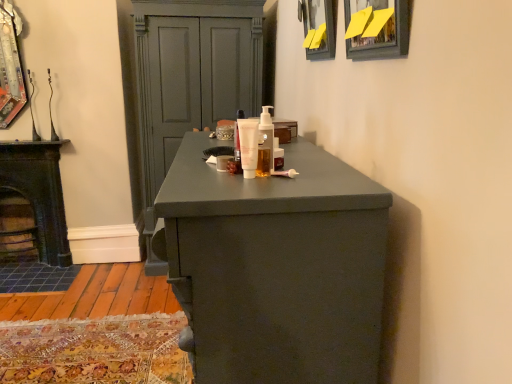
Measure the distance between point (247, 174) and camera.

They are 3.65 feet apart.

The image size is (512, 384). Describe the element at coordinates (237, 143) in the screenshot. I see `white matte tube at center` at that location.

Describe the element at coordinates (190, 80) in the screenshot. I see `matte gray cupboard at center` at that location.

What do you see at coordinates (319, 28) in the screenshot? The width and height of the screenshot is (512, 384). I see `matte black picture frame at upper center, which is the first picture frame from back to front` at bounding box center [319, 28].

Locate an element on the screen. The image size is (512, 384). white matte tube at center, marked as the 2th mouthwash in a back-to-front arrangement is located at coordinates (248, 146).

Does point (264, 175) appear closer or farther from the camera than point (183, 275)?

Point (264, 175) is positioned farther from the camera compared to point (183, 275).

From the image's perspective, which one is positioned lower, translucent plastic mouthwash at center, which ranks as the 1th mouthwash in back-to-front order, or matte gray chest of drawers at center?

matte gray chest of drawers at center.

Is translucent plastic mouthwash at center, which ranks as the 1th mouthwash in back-to-front order, next to matte gray chest of drawers at center?

No, translucent plastic mouthwash at center, which ranks as the 1th mouthwash in back-to-front order, is not touching matte gray chest of drawers at center.

In terms of size, does translucent plastic mouthwash at center, which ranks as the 1th mouthwash in back-to-front order, appear bigger or smaller than matte gray chest of drawers at center?

Considering their sizes, translucent plastic mouthwash at center, which ranks as the 1th mouthwash in back-to-front order, takes up less space than matte gray chest of drawers at center.

Could you tell me if matte black picture frame at upper center, which is the first picture frame from back to front, is turned towards white matte tube at center, marked as the 2th mouthwash in a back-to-front arrangement?

No, matte black picture frame at upper center, which is the first picture frame from back to front, is not facing towards white matte tube at center, marked as the 2th mouthwash in a back-to-front arrangement.

Can you confirm if matte black picture frame at upper center, arranged as the 2th picture frame when viewed from the front, is shorter than white matte tube at center, marked as the 2th mouthwash in a back-to-front arrangement?

Incorrect, the height of matte black picture frame at upper center, arranged as the 2th picture frame when viewed from the front, does not fall short of that of white matte tube at center, marked as the 2th mouthwash in a back-to-front arrangement.

From the image's perspective, which object appears higher, matte black picture frame at upper center, which is the first picture frame from back to front, or white matte tube at center, the first mouthwash in the front-to-back sequence?

matte black picture frame at upper center, which is the first picture frame from back to front, from the image's perspective.

Is matte black picture frame at upper center, which is the first picture frame from back to front, next to white matte tube at center, the first mouthwash in the front-to-back sequence, and touching it?

No, matte black picture frame at upper center, which is the first picture frame from back to front, is not touching white matte tube at center, the first mouthwash in the front-to-back sequence.

Where is `chest of drawers below the yellow paper at upper center, which appears as the 1th picture frame when viewed from the front (from a real-world perspective)`? This screenshot has width=512, height=384. chest of drawers below the yellow paper at upper center, which appears as the 1th picture frame when viewed from the front (from a real-world perspective) is located at coordinates (276, 268).

Who is taller, matte gray chest of drawers at center or yellow paper at upper center, the second picture frame when ordered from back to front?

Standing taller between the two is matte gray chest of drawers at center.

Can you tell me how much matte gray chest of drawers at center and yellow paper at upper center, which appears as the 1th picture frame when viewed from the front, differ in facing direction?

There is a 0.599-degree angle between the facing directions of matte gray chest of drawers at center and yellow paper at upper center, which appears as the 1th picture frame when viewed from the front.

Considering the sizes of objects matte gray chest of drawers at center and yellow paper at upper center, which appears as the 1th picture frame when viewed from the front, in the image provided, who is wider, matte gray chest of drawers at center or yellow paper at upper center, which appears as the 1th picture frame when viewed from the front,?

With larger width is matte gray chest of drawers at center.

Between matte gray cupboard at center and matte black picture frame at upper center, arranged as the 2th picture frame when viewed from the front, which one has smaller width?

With smaller width is matte black picture frame at upper center, arranged as the 2th picture frame when viewed from the front.

Is point (249, 92) positioned before point (308, 25)?

No, (249, 92) is behind (308, 25).

The image size is (512, 384). Find the location of `cupboard below the matte black picture frame at upper center, which is the first picture frame from back to front (from a real-world perspective)`. cupboard below the matte black picture frame at upper center, which is the first picture frame from back to front (from a real-world perspective) is located at coordinates (190, 80).

Which object is more forward, matte gray cupboard at center or matte black picture frame at upper center, arranged as the 2th picture frame when viewed from the front?

matte black picture frame at upper center, arranged as the 2th picture frame when viewed from the front, is closer to the camera.

Looking at this image, considering the sizes of white matte tube at center, the first mouthwash in the front-to-back sequence, and white matte tube at center in the image, is white matte tube at center, the first mouthwash in the front-to-back sequence, taller or shorter than white matte tube at center?

In the image, white matte tube at center, the first mouthwash in the front-to-back sequence, appears to be shorter than white matte tube at center.

From the image's perspective, between white matte tube at center, the first mouthwash in the front-to-back sequence, and white matte tube at center, who is located below?

white matte tube at center, the first mouthwash in the front-to-back sequence, appears lower in the image.

The image size is (512, 384). There is a white matte tube at center. In order to click on the 2nd mouthwash below it (from the image's perspective) in this screenshot , I will do `click(248, 146)`.

Can you tell me how much white matte tube at center, the first mouthwash in the front-to-back sequence, and white matte tube at center differ in facing direction?

The angle between the facing direction of white matte tube at center, the first mouthwash in the front-to-back sequence, and the facing direction of white matte tube at center is 0.000691 degrees.

Between matte black picture frame at upper center, which is the first picture frame from back to front, and black cast iron stove at left, which one has larger width?

black cast iron stove at left.

From the image's perspective, which is above, matte black picture frame at upper center, which is the first picture frame from back to front, or black cast iron stove at left?

matte black picture frame at upper center, which is the first picture frame from back to front.

You are a GUI agent. You are given a task and a screenshot of the screen. Output one action in this format:
    pyautogui.click(x=<x>, y=<y>)
    Task: Click on the stove below the matte black picture frame at upper center, arranged as the 2th picture frame when viewed from the front (from a real-world perspective)
    The width and height of the screenshot is (512, 384).
    Given the screenshot: What is the action you would take?
    39,192

Can you tell me how much matte black picture frame at upper center, arranged as the 2th picture frame when viewed from the front, and black cast iron stove at left differ in facing direction?

There is a 91-degree angle between the facing directions of matte black picture frame at upper center, arranged as the 2th picture frame when viewed from the front, and black cast iron stove at left.

Which object is closer to the camera taking this photo, yellow paper at upper center, which appears as the 1th picture frame when viewed from the front, or matte gray cupboard at center?

yellow paper at upper center, which appears as the 1th picture frame when viewed from the front, is more forward.

Considering the points (359, 19) and (163, 68), which point is behind, point (359, 19) or point (163, 68)?

The point (163, 68) is behind.

Is yellow paper at upper center, the second picture frame when ordered from back to front, positioned with its back to matte gray cupboard at center?

No, yellow paper at upper center, the second picture frame when ordered from back to front,'s orientation is not away from matte gray cupboard at center.

Considering the sizes of yellow paper at upper center, the second picture frame when ordered from back to front, and matte gray cupboard at center in the image, is yellow paper at upper center, the second picture frame when ordered from back to front, taller or shorter than matte gray cupboard at center?

Clearly, yellow paper at upper center, the second picture frame when ordered from back to front, is shorter compared to matte gray cupboard at center.

This screenshot has width=512, height=384. Identify the location of chest of drawers on the left of translucent plastic mouthwash at center, which is the 2th mouthwash from front to back. (276, 268).

Identify the location of mouthwash that is the 2nd object directly below the matte black picture frame at upper center, arranged as the 2th picture frame when viewed from the front (from a real-world perspective). (248, 146).

Looking at the image, which one is located further to white matte tube at center, marked as the 2th mouthwash in a back-to-front arrangement, white matte tube at center or black cast iron stove at left?

Among the two, black cast iron stove at left is located further to white matte tube at center, marked as the 2th mouthwash in a back-to-front arrangement.

Based on their spatial positions, is white matte tube at center or translucent plastic mouthwash at center, which ranks as the 1th mouthwash in back-to-front order, closer to black cast iron stove at left?

white matte tube at center.

When comparing their distances from matte black picture frame at upper center, which is the first picture frame from back to front, does translucent plastic mouthwash at center, which ranks as the 1th mouthwash in back-to-front order, or matte gray chest of drawers at center seem closer?

translucent plastic mouthwash at center, which ranks as the 1th mouthwash in back-to-front order, is positioned closer to the anchor matte black picture frame at upper center, which is the first picture frame from back to front.

From the image, which object appears to be farther from black cast iron stove at left, matte gray chest of drawers at center or translucent plastic mouthwash at center, which is the 2th mouthwash from front to back?

matte gray chest of drawers at center is further to black cast iron stove at left.

Estimate the real-world distances between objects in this image. Which object is further from white matte tube at center, the first mouthwash in the front-to-back sequence, yellow paper at upper center, which appears as the 1th picture frame when viewed from the front, or black cast iron stove at left?

Based on the image, black cast iron stove at left appears to be further to white matte tube at center, the first mouthwash in the front-to-back sequence.

When comparing their distances from matte black picture frame at upper center, which is the first picture frame from back to front, does white matte tube at center or matte gray cupboard at center seem further?

matte gray cupboard at center is further to matte black picture frame at upper center, which is the first picture frame from back to front.

From the image, which object appears to be nearer to translucent plastic mouthwash at center, which ranks as the 1th mouthwash in back-to-front order, black cast iron stove at left or matte gray cupboard at center?

matte gray cupboard at center is positioned closer to the anchor translucent plastic mouthwash at center, which ranks as the 1th mouthwash in back-to-front order.

Estimate the real-world distances between objects in this image. Which object is closer to matte gray cupboard at center, white matte tube at center or yellow paper at upper center, the second picture frame when ordered from back to front?

white matte tube at center is positioned closer to the anchor matte gray cupboard at center.

Locate an element on the screen. The image size is (512, 384). picture frame between white matte tube at center, marked as the 2th mouthwash in a back-to-front arrangement, and matte gray cupboard at center, along the z-axis is located at coordinates pyautogui.click(x=319, y=28).

This screenshot has height=384, width=512. I want to click on cupboard positioned between translucent plastic mouthwash at center, which ranks as the 1th mouthwash in back-to-front order, and black cast iron stove at left from near to far, so click(x=190, y=80).

Where is `cupboard between matte gray chest of drawers at center and black cast iron stove at left along the z-axis`? The height and width of the screenshot is (384, 512). cupboard between matte gray chest of drawers at center and black cast iron stove at left along the z-axis is located at coordinates (190, 80).

Where is `cupboard between black cast iron stove at left and matte black picture frame at upper center, which is the first picture frame from back to front, in the horizontal direction`? This screenshot has width=512, height=384. cupboard between black cast iron stove at left and matte black picture frame at upper center, which is the first picture frame from back to front, in the horizontal direction is located at coordinates (190, 80).